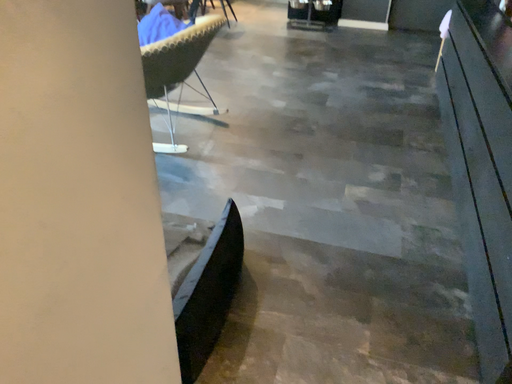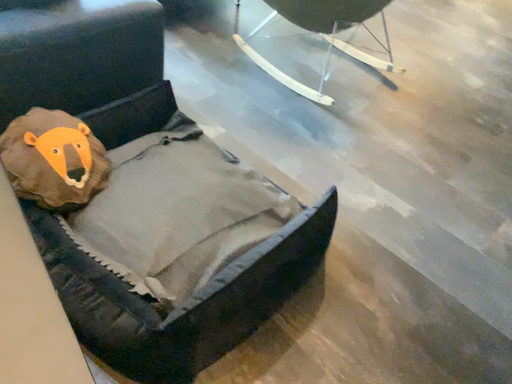
Question: How did the camera likely rotate when shooting the video?

Choices:
 (A) rotated left
 (B) rotated right

Answer: (A)